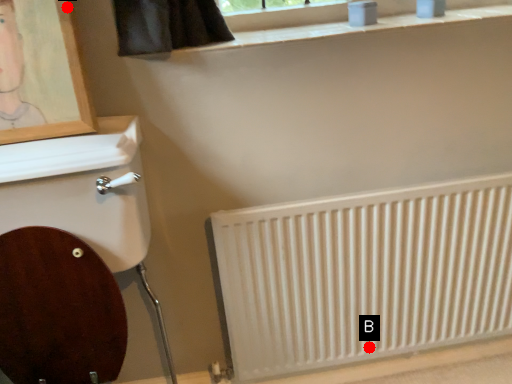
Question: Two points are circled on the image, labeled by A and B beside each circle. Which point appears closest to the camera in this image?

Choices:
 (A) A is closer
 (B) B is closer

Answer: (A)